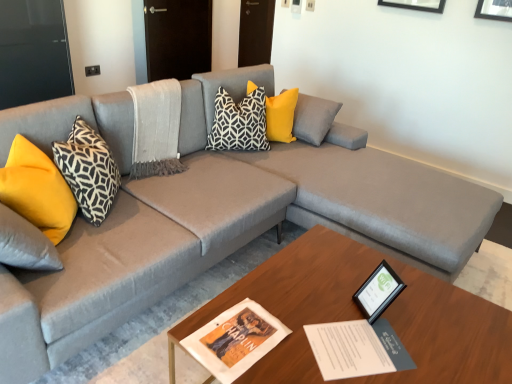
Question: Can you confirm if black and white geometric pillow at center, positioned as the 3th pillow in left-to-right order, is positioned to the left of yellow fabric pillow at center, the 4th pillow viewed from the left?

Choices:
 (A) no
 (B) yes

Answer: (B)

Question: Does black and white geometric pillow at center, positioned as the 3th pillow in left-to-right order, appear on the right side of yellow fabric pillow at center, placed as the first pillow when sorted from right to left?

Choices:
 (A) yes
 (B) no

Answer: (B)

Question: Is black and white geometric pillow at center, positioned as the 3th pillow in left-to-right order, facing towards yellow fabric pillow at center, the 4th pillow viewed from the left?

Choices:
 (A) yes
 (B) no

Answer: (B)

Question: Does black and white geometric pillow at center, positioned as the 3th pillow in left-to-right order, come behind yellow fabric pillow at center, placed as the first pillow when sorted from right to left?

Choices:
 (A) no
 (B) yes

Answer: (A)

Question: Are black and white geometric pillow at center, the second pillow viewed from the right, and yellow fabric pillow at center, the 4th pillow viewed from the left, far apart?

Choices:
 (A) yes
 (B) no

Answer: (B)

Question: Is point (245, 145) positioned closer to the camera than point (403, 283)?

Choices:
 (A) closer
 (B) farther

Answer: (B)

Question: Considering the positions of black and white geometric pillow at center, positioned as the 3th pillow in left-to-right order, and black glossy picture frame at lower right in the image, is black and white geometric pillow at center, positioned as the 3th pillow in left-to-right order, wider or thinner than black glossy picture frame at lower right?

Choices:
 (A) thin
 (B) wide

Answer: (B)

Question: Considering the positions of black and white geometric pillow at center, positioned as the 3th pillow in left-to-right order, and black glossy picture frame at lower right in the image, is black and white geometric pillow at center, positioned as the 3th pillow in left-to-right order, taller or shorter than black glossy picture frame at lower right?

Choices:
 (A) tall
 (B) short

Answer: (A)

Question: From a real-world perspective, is black and white geometric pillow at center, positioned as the 3th pillow in left-to-right order, above or below black glossy picture frame at lower right?

Choices:
 (A) above
 (B) below

Answer: (A)

Question: From their relative heights in the image, would you say wooden coffee table at center is taller or shorter than black and white geometric pillow at left, arranged as the 2th pillow when viewed from the left?

Choices:
 (A) tall
 (B) short

Answer: (B)

Question: Is wooden coffee table at center wider or thinner than black and white geometric pillow at left, arranged as the 2th pillow when viewed from the left?

Choices:
 (A) wide
 (B) thin

Answer: (A)

Question: Is point (323, 321) positioned closer to the camera than point (78, 117)?

Choices:
 (A) closer
 (B) farther

Answer: (A)

Question: Choose the correct answer: Is wooden coffee table at center inside black and white geometric pillow at left, arranged as the 2th pillow when viewed from the left, or outside it?

Choices:
 (A) inside
 (B) outside

Answer: (B)

Question: Does point (367, 284) appear closer or farther from the camera than point (69, 190)?

Choices:
 (A) farther
 (B) closer

Answer: (B)

Question: From the image's perspective, relative to yellow fabric pillow at left, placed as the 4th pillow when sorted from right to left, is black glossy picture frame at lower right above or below?

Choices:
 (A) above
 (B) below

Answer: (B)